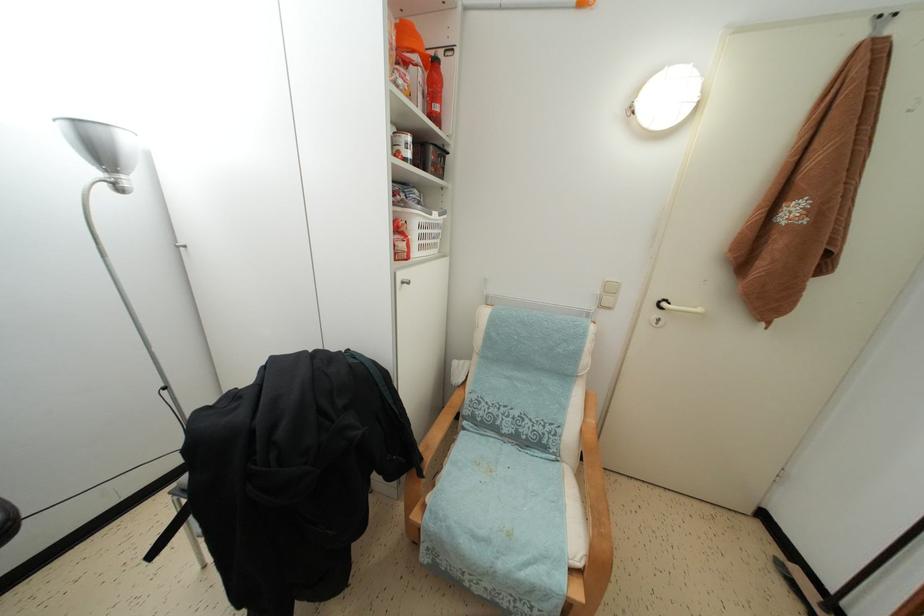
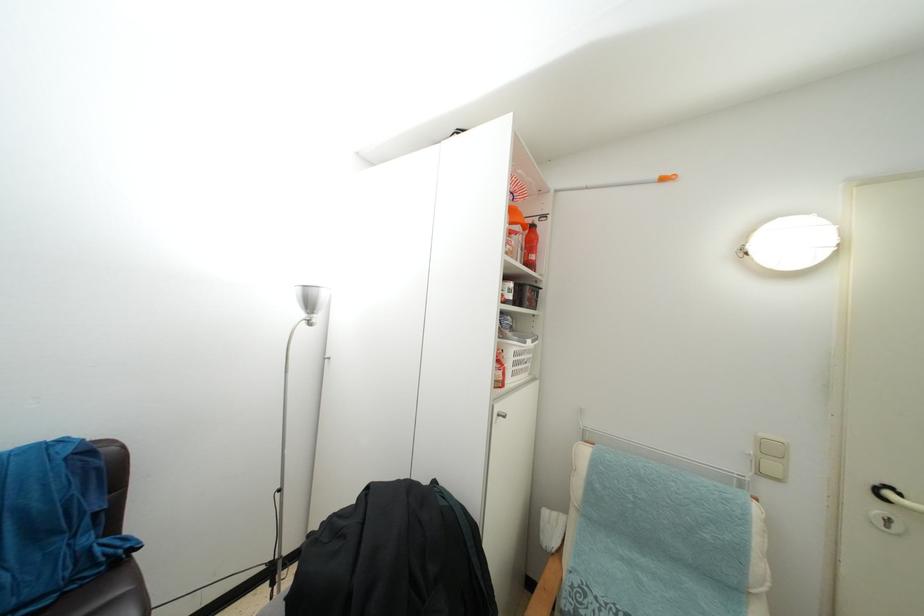
Locate, in the second image, the point that corresponds to pixel 426 241 in the first image.

(519, 370)